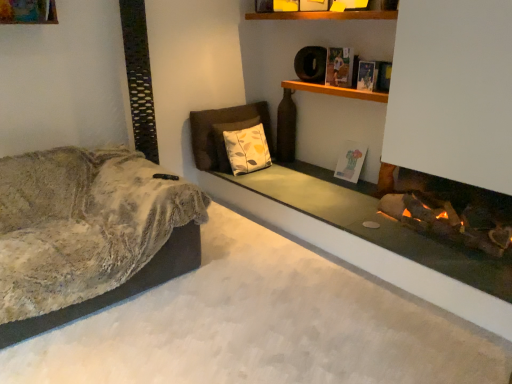
Question: Is the position of hardcover book at upper right, which is counted as the second book, starting from the top, less distant than that of hardcover book at upper center, which ranks as the first book in top-to-bottom order?

Choices:
 (A) yes
 (B) no

Answer: (A)

Question: Is hardcover book at upper right, the 1th book when ordered from front to back, bigger than hardcover book at upper center, which appears as the second book when viewed from the back?

Choices:
 (A) no
 (B) yes

Answer: (A)

Question: From a real-world perspective, is hardcover book at upper right, arranged as the third book when viewed from the back, located higher than hardcover book at upper center, the 3th book from the bottom?

Choices:
 (A) no
 (B) yes

Answer: (A)

Question: From the image's perspective, is hardcover book at upper right, the 1th book when ordered from front to back, below hardcover book at upper center, which appears as the second book when viewed from the front?

Choices:
 (A) yes
 (B) no

Answer: (A)

Question: From a real-world perspective, is hardcover book at upper right, arranged as the third book when viewed from the back, below hardcover book at upper center, the 3th book from the bottom?

Choices:
 (A) no
 (B) yes

Answer: (B)

Question: Could you tell me if hardcover book at upper right, the 1th book when ordered from front to back, is turned towards hardcover book at upper center, which appears as the second book when viewed from the back?

Choices:
 (A) yes
 (B) no

Answer: (B)

Question: From a real-world perspective, is hardcover book at upper right, arranged as the third book when viewed from the back, on top of fuzzy beige couch at left?

Choices:
 (A) yes
 (B) no

Answer: (A)

Question: Can you confirm if hardcover book at upper right, which is counted as the second book, starting from the top, is thinner than fuzzy beige couch at left?

Choices:
 (A) yes
 (B) no

Answer: (A)

Question: Considering the relative sizes of hardcover book at upper right, the 1th book when ordered from front to back, and fuzzy beige couch at left in the image provided, is hardcover book at upper right, the 1th book when ordered from front to back, smaller than fuzzy beige couch at left?

Choices:
 (A) no
 (B) yes

Answer: (B)

Question: Is hardcover book at upper right, the 1th book when ordered from front to back, positioned with its back to fuzzy beige couch at left?

Choices:
 (A) yes
 (B) no

Answer: (B)

Question: Is fuzzy beige couch at left a part of hardcover book at upper right, the 1th book when ordered from front to back?

Choices:
 (A) yes
 (B) no

Answer: (B)

Question: Does hardcover book at upper right, arranged as the third book when viewed from the back, have a lesser height compared to fuzzy beige couch at left?

Choices:
 (A) yes
 (B) no

Answer: (A)

Question: Is smooth concrete fireplace at lower right shorter than hardcover book at upper center, which ranks as the first book in top-to-bottom order?

Choices:
 (A) no
 (B) yes

Answer: (B)